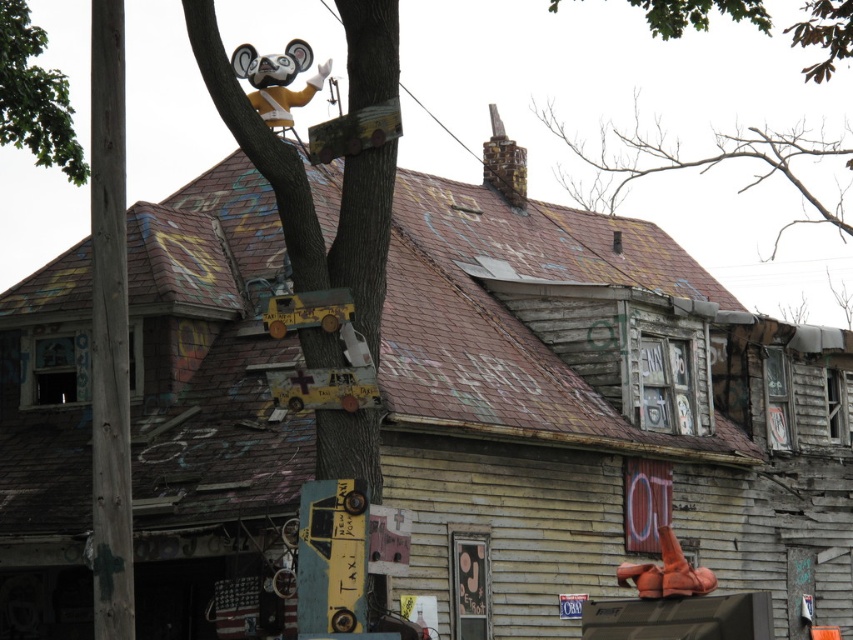
Question: Which of the following is the farthest from the observer?

Choices:
 (A) (61, 108)
 (B) (396, 4)
 (C) (608, 125)
 (D) (734, 12)

Answer: (C)

Question: Is wooden tree trunk at upper center smaller than green leafy tree at upper center?

Choices:
 (A) yes
 (B) no

Answer: (A)

Question: Is wooden tree trunk at upper center bigger than green rough bark tree at upper left?

Choices:
 (A) yes
 (B) no

Answer: (B)

Question: Does green rough bark tree at upper left lie in front of green leafy tree at upper center?

Choices:
 (A) yes
 (B) no

Answer: (B)

Question: Estimate the real-world distances between objects in this image. Which object is farther from the wooden tree trunk at upper center?

Choices:
 (A) green leafy tree at upper center
 (B) green rough bark tree at upper left

Answer: (A)

Question: Which point is farther to the camera?

Choices:
 (A) (32, 56)
 (B) (585, 147)
 (C) (701, 20)
 (D) (344, 456)

Answer: (B)